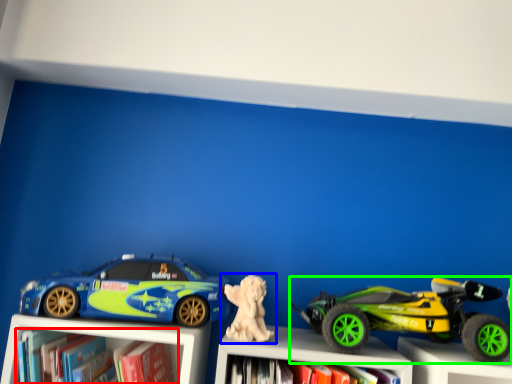
Question: Estimate the real-world distances between objects in this image. Which object is closer to book (highlighted by a red box), toy (highlighted by a blue box) or toy (highlighted by a green box)?

Choices:
 (A) toy
 (B) toy

Answer: (A)